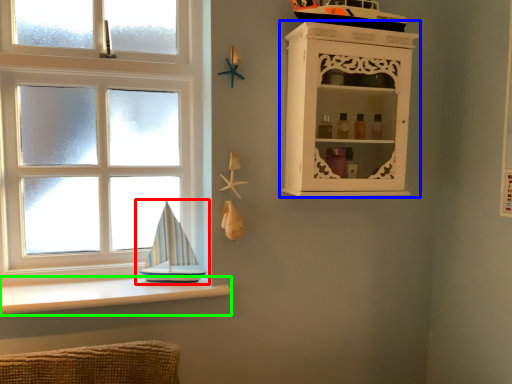
Question: Estimate the real-world distances between objects in this image. Which object is farther from boat (highlighted by a red box), shelf (highlighted by a blue box) or ledge (highlighted by a green box)?

Choices:
 (A) shelf
 (B) ledge

Answer: (A)